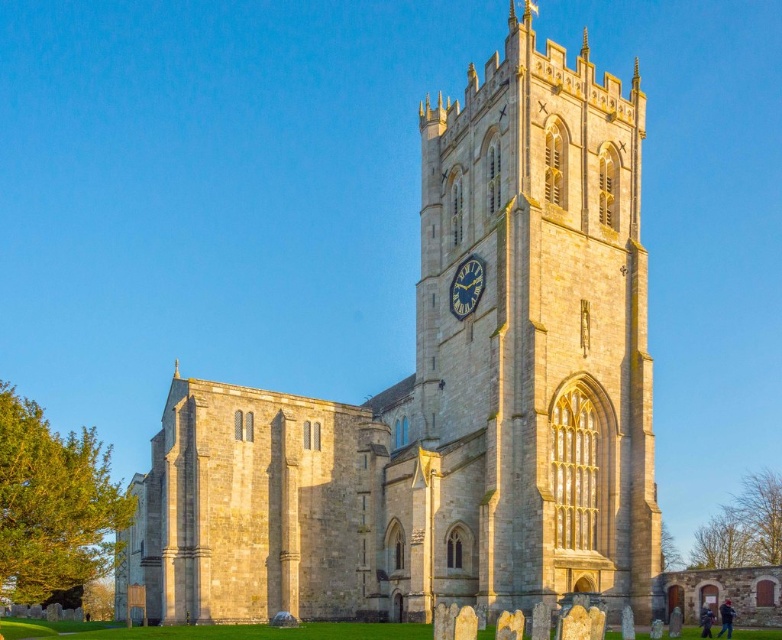
Who is more forward, (501, 257) or (476, 292)?

Point (501, 257) is in front.

The height and width of the screenshot is (640, 782). Identify the location of stone clock tower at center. (533, 342).

Does stone church at center have a greater width compared to matte stone clock at center?

Correct, the width of stone church at center exceeds that of matte stone clock at center.

In the scene shown: Does stone church at center appear on the right side of matte stone clock at center?

Incorrect, stone church at center is not on the right side of matte stone clock at center.

What are the coordinates of `stone church at center` in the screenshot? It's located at (447, 397).

Who is positioned more to the right, stone church at center or stone clock tower at center?

stone clock tower at center

Is point (608, 413) less distant than point (490, 129)?

Yes, point (608, 413) is in front of point (490, 129).

The width and height of the screenshot is (782, 640). In order to click on stone church at center in this screenshot , I will do pyautogui.click(x=447, y=397).

Where is `stone church at center`? stone church at center is located at coordinates (447, 397).